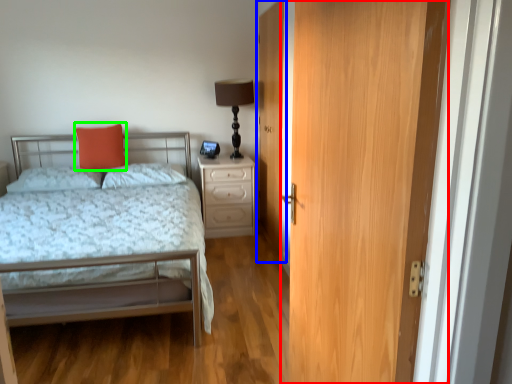
Question: Which object is the farthest from door (highlighted by a red box)? Choose among these: door (highlighted by a blue box) or throw pillow (highlighted by a green box).

Choices:
 (A) door
 (B) throw pillow

Answer: (B)